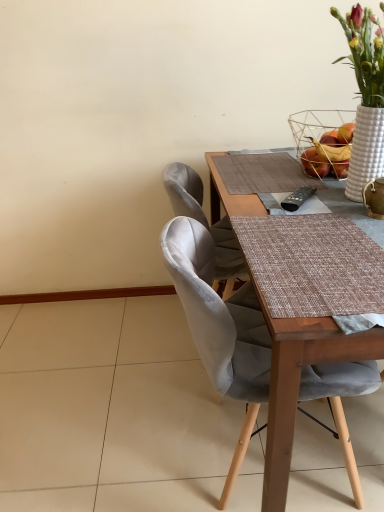
Locate an element on the screen. The image size is (384, 512). vacant space that is to the left of white textured basket at upper right is located at coordinates (264, 175).